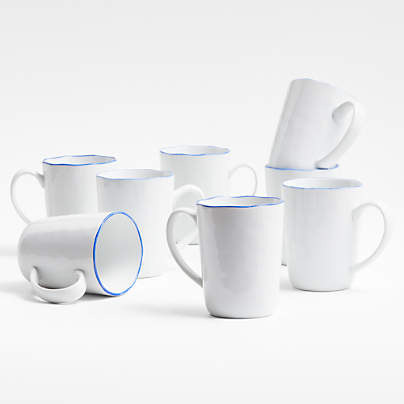
Where is `mug handles`? The height and width of the screenshot is (404, 404). mug handles is located at coordinates (69, 292), (176, 215), (187, 187), (251, 170), (352, 122), (378, 210), (22, 168).